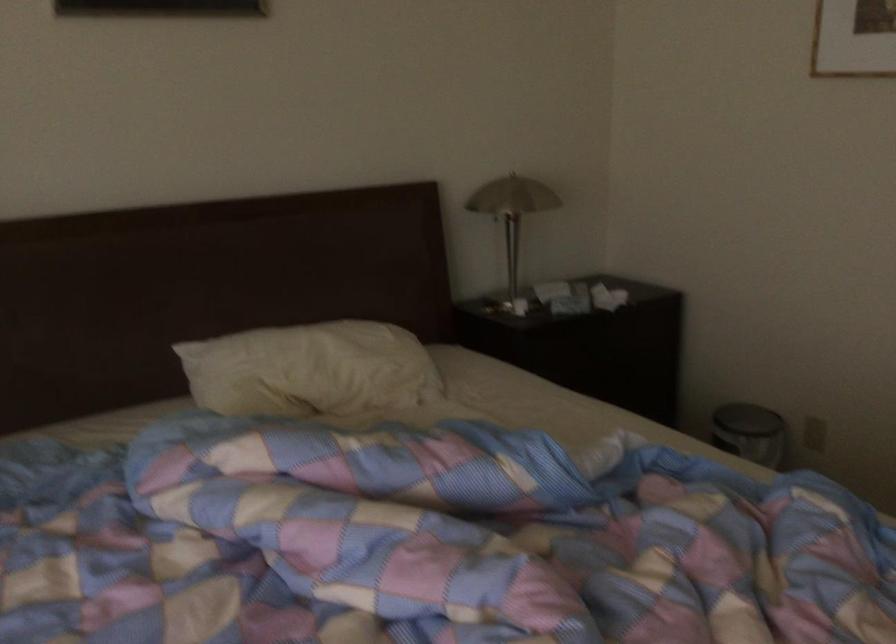
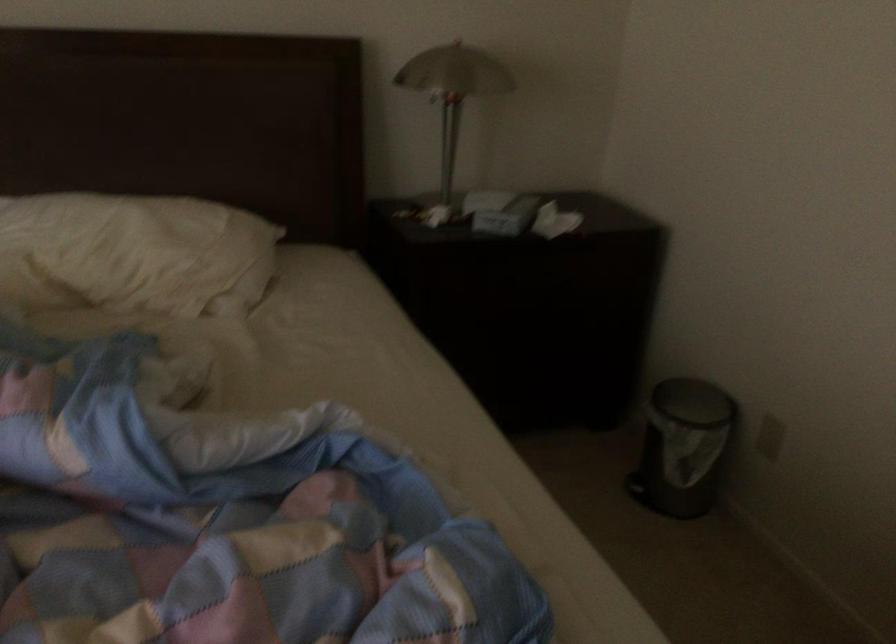
Where in the second image is the point corresponding to point 333,366 from the first image?

(133, 254)